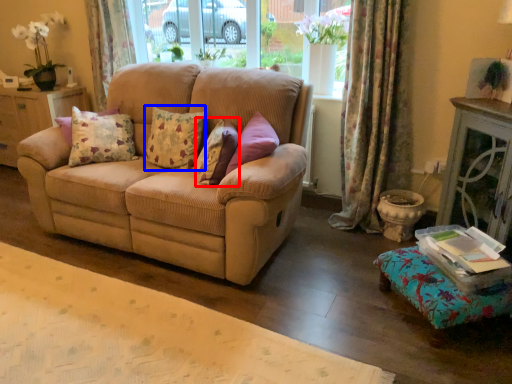
Question: Among these objects, which one is farthest to the camera, pillow (highlighted by a red box) or pillow (highlighted by a blue box)?

Choices:
 (A) pillow
 (B) pillow

Answer: (B)